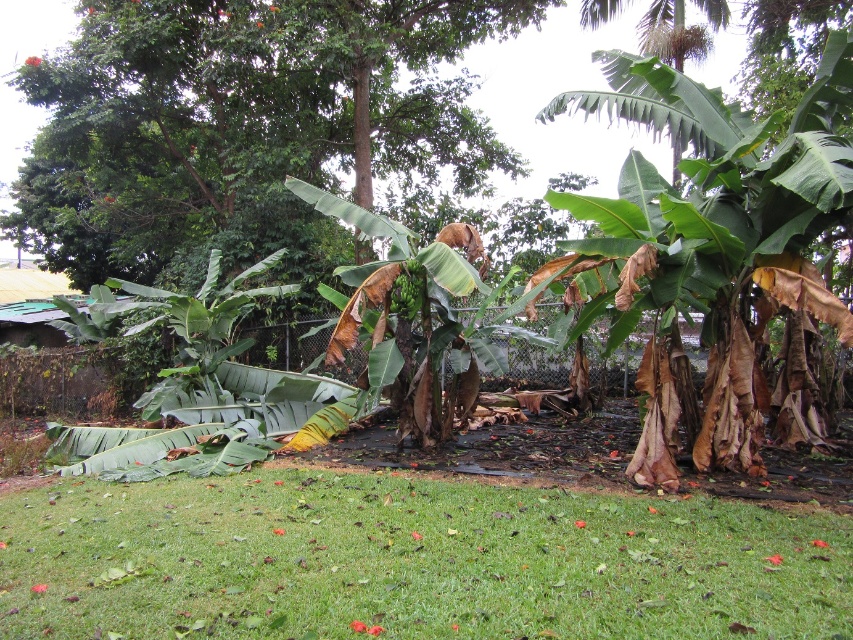
Question: Can you confirm if green grass at lower center is wider than green leafy tree at center?

Choices:
 (A) no
 (B) yes

Answer: (A)

Question: Is green leafy banana tree at center wider than green matte bananas at center?

Choices:
 (A) no
 (B) yes

Answer: (B)

Question: Which of these objects is positioned closest to the green leafy banana tree at center?

Choices:
 (A) green matte bananas at center
 (B) green leafy tree at center

Answer: (A)

Question: Which object is the farthest from the green leafy tree at center?

Choices:
 (A) green grass at lower center
 (B) green matte bananas at center

Answer: (A)

Question: Is green leafy tree at center positioned behind green matte bananas at center?

Choices:
 (A) yes
 (B) no

Answer: (A)

Question: Considering the real-world distances, which object is closest to the green leafy banana tree at center?

Choices:
 (A) green grass at lower center
 (B) green leafy tree at center

Answer: (A)